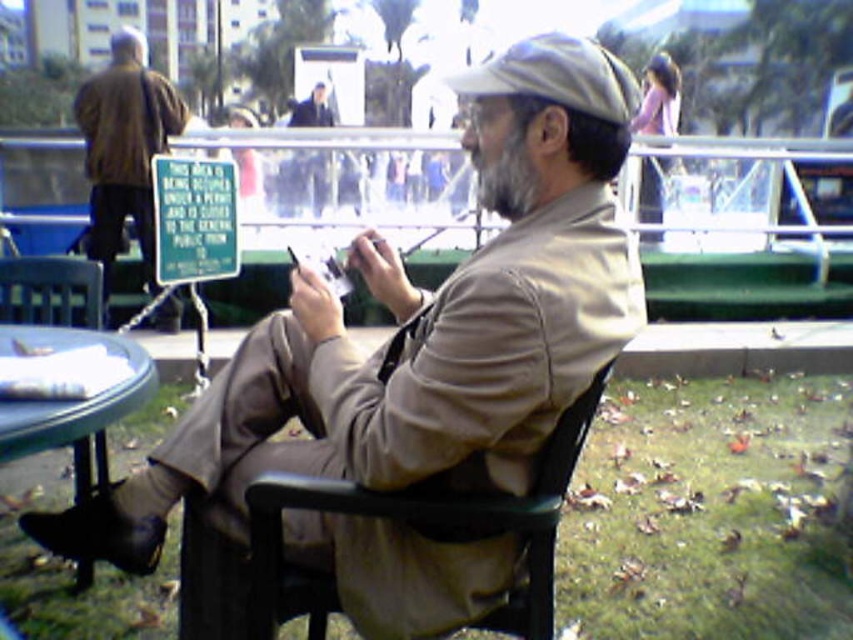
You are standing in the park and want to take a photo of the man sitting on the black chair. You notice two points in the image labeled as point (599, 227) and point (175, 99). Which point should you focus on to ensure the man is in sharp focus?

You should focus on point (599, 227) because it is closer to the camera than point (175, 99), ensuring the man is in sharp focus.

You are standing at the point labeled point (x=91, y=346) and want to walk to the point labeled point (x=262, y=552). Which direction should you move relative to the man sitting on the black chair?

You should move forward relative to the man sitting on the black chair because point (x=262, y=552) is in front of point (x=91, y=346).